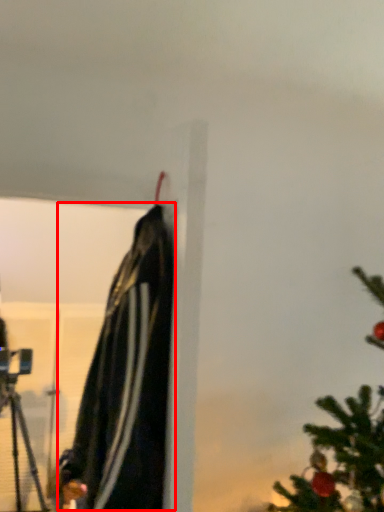
Question: In this image, where is cloak (annotated by the red box) located relative to tripod?

Choices:
 (A) right
 (B) left

Answer: (A)